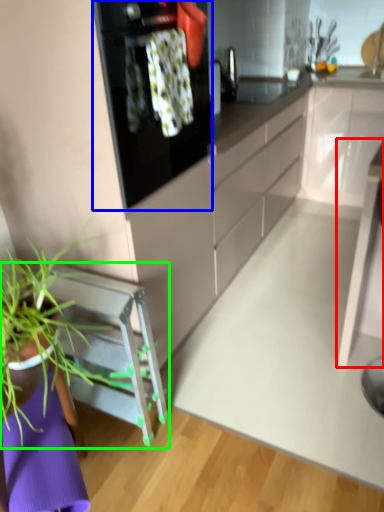
Question: Which is nearer to the table (highlighted by a red box)? kitchen appliance (highlighted by a blue box) or furniture (highlighted by a green box).

Choices:
 (A) kitchen appliance
 (B) furniture

Answer: (B)